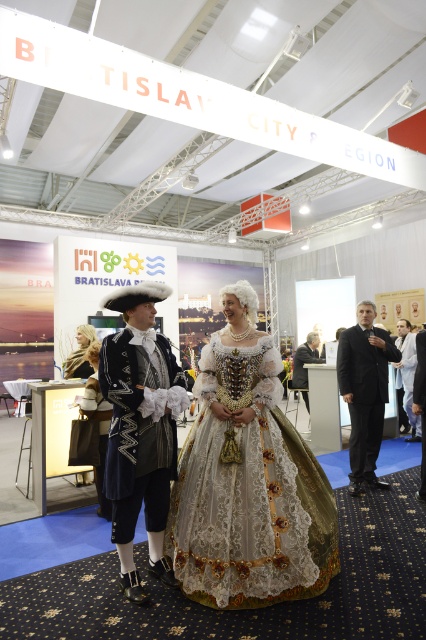
Between dark gray suit at center and smooth cream scarf at center, which one has more height?

With more height is dark gray suit at center.

You are a GUI agent. You are given a task and a screenshot of the screen. Output one action in this format:
    pyautogui.click(x=<x>, y=<y>)
    Task: Click on the dark gray suit at center
    This screenshot has width=426, height=640.
    Given the screenshot: What is the action you would take?
    pyautogui.click(x=304, y=362)

Find the location of `dark gray suit at center`. dark gray suit at center is located at coordinates (304, 362).

Which is above, lace fabric dress at center or matte black coat at center?

matte black coat at center

Find the location of `lace fabric dress at center`. lace fabric dress at center is located at coordinates (249, 492).

Find the location of a particular element. lace fabric dress at center is located at coordinates (249, 492).

Is white fabric suit at center above smooth cream scarf at center?

No.

I want to click on white fabric suit at center, so click(x=406, y=372).

Between point (411, 333) and point (71, 372), which one is positioned in front?

Point (71, 372) is in front.

Where is `white fabric suit at center`? white fabric suit at center is located at coordinates (406, 372).